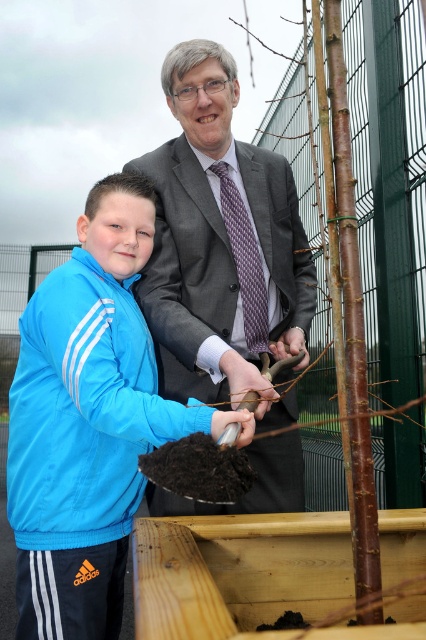
Who is taller, matte black glove at center or white matte shovel at lower center?

matte black glove at center

In the scene shown: Is matte black glove at center below white matte shovel at lower center?

No.

Who is more forward, [236,394] or [226,417]?

Point [226,417] is more forward.

Image resolution: width=426 pixels, height=640 pixels. In order to click on matte black glove at center in this screenshot , I will do `click(245, 381)`.

Who is positioned more to the right, purple textured tie at center or white matte shovel at lower center?

From the viewer's perspective, purple textured tie at center appears more on the right side.

Measure the distance between purple textured tie at center and white matte shovel at lower center.

purple textured tie at center and white matte shovel at lower center are 33.08 inches apart.

You are a GUI agent. You are given a task and a screenshot of the screen. Output one action in this format:
    pyautogui.click(x=<x>, y=<y>)
    Task: Click on the purple textured tie at center
    The image size is (426, 640).
    Given the screenshot: What is the action you would take?
    pyautogui.click(x=244, y=260)

Is matte gray suit at center positioned in front of brown rough bark tree at center?

Yes.

Can you confirm if matte gray suit at center is taller than brown rough bark tree at center?

No, matte gray suit at center is not taller than brown rough bark tree at center.

The image size is (426, 640). What do you see at coordinates (219, 236) in the screenshot? I see `matte gray suit at center` at bounding box center [219, 236].

Locate an element on the screen. Image resolution: width=426 pixels, height=640 pixels. matte gray suit at center is located at coordinates (219, 236).